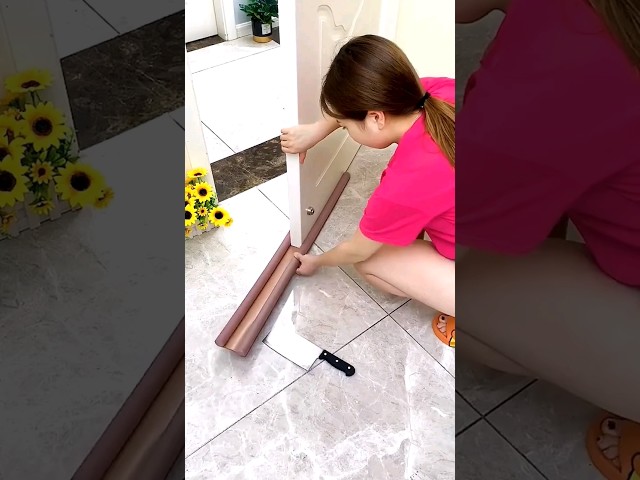
At what (x,y) coordinates should I click in order to perform the action: click on white door. Please return your answer as a coordinate pair (x, y). The image size is (640, 480). Looking at the image, I should click on (296, 38).